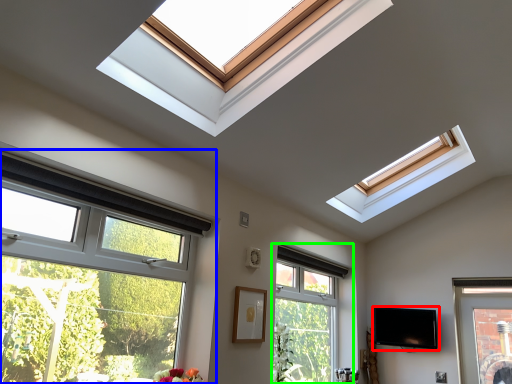
Question: Which object is the closest to the television (highlighted by a red box)? Choose among these: window (highlighted by a blue box) or window (highlighted by a green box).

Choices:
 (A) window
 (B) window

Answer: (B)